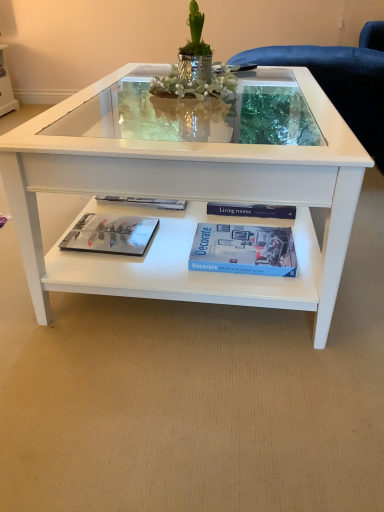
Question: Is matte glossy magazine at lower left placed right next to blue matte book at center?

Choices:
 (A) no
 (B) yes

Answer: (A)

Question: Can you confirm if matte glossy magazine at lower left is thinner than blue matte book at center?

Choices:
 (A) no
 (B) yes

Answer: (B)

Question: Is matte glossy magazine at lower left wider than blue matte book at center?

Choices:
 (A) yes
 (B) no

Answer: (B)

Question: Considering the relative sizes of matte glossy magazine at lower left and blue matte book at center in the image provided, is matte glossy magazine at lower left smaller than blue matte book at center?

Choices:
 (A) no
 (B) yes

Answer: (B)

Question: From the image's perspective, is matte glossy magazine at lower left under blue matte book at center?

Choices:
 (A) yes
 (B) no

Answer: (B)

Question: Choose the correct answer: Is white glossy coffee table at center inside matte glossy magazine at lower left or outside it?

Choices:
 (A) inside
 (B) outside

Answer: (B)

Question: Considering the positions of white glossy coffee table at center and matte glossy magazine at lower left in the image, is white glossy coffee table at center wider or thinner than matte glossy magazine at lower left?

Choices:
 (A) thin
 (B) wide

Answer: (B)

Question: Relative to matte glossy magazine at lower left, is white glossy coffee table at center in front or behind?

Choices:
 (A) front
 (B) behind

Answer: (A)

Question: From the image's perspective, relative to matte glossy magazine at lower left, is white glossy coffee table at center above or below?

Choices:
 (A) above
 (B) below

Answer: (A)

Question: Is blue matte book at center situated inside matte glossy magazine at lower left or outside?

Choices:
 (A) outside
 (B) inside

Answer: (A)

Question: Based on their sizes in the image, would you say blue matte book at center is bigger or smaller than matte glossy magazine at lower left?

Choices:
 (A) small
 (B) big

Answer: (B)

Question: In terms of height, does blue matte book at center look taller or shorter compared to matte glossy magazine at lower left?

Choices:
 (A) tall
 (B) short

Answer: (A)

Question: From the image's perspective, is blue matte book at center above or below matte glossy magazine at lower left?

Choices:
 (A) above
 (B) below

Answer: (B)

Question: Relative to white glossy coffee table at center, is blue matte book at center in front or behind?

Choices:
 (A) front
 (B) behind

Answer: (B)

Question: Is blue matte book at center spatially inside white glossy coffee table at center, or outside of it?

Choices:
 (A) inside
 (B) outside

Answer: (A)